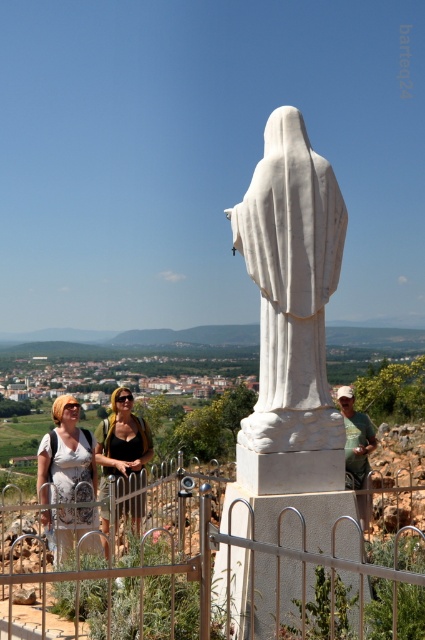
Question: Is matte white blouse at center behind black fabric dress at lower center?

Choices:
 (A) no
 (B) yes

Answer: (B)

Question: Which object is positioned farthest from the white marble statue at center?

Choices:
 (A) white stone statue at center
 (B) gold metallic fence at lower center
 (C) matte white blouse at center

Answer: (C)

Question: Which of the following is the farthest from the observer?

Choices:
 (A) gold metallic fence at lower center
 (B) white marble statue at center

Answer: (B)

Question: Is gold metallic fence at lower center smaller than black fabric dress at lower center?

Choices:
 (A) yes
 (B) no

Answer: (B)

Question: Which point is closer to the camera?

Choices:
 (A) (345, 465)
 (B) (130, 504)
 (C) (291, 314)

Answer: (C)

Question: Does white marble statue at center have a larger size compared to matte white blouse at center?

Choices:
 (A) yes
 (B) no

Answer: (B)